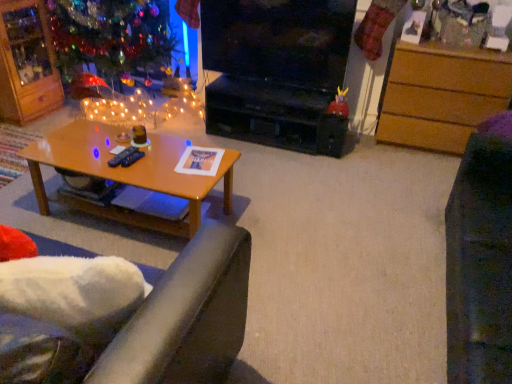
The image size is (512, 384). Find the location of `free space in front of satin blue remote control at center, which is the 1th remote control from left to right`. free space in front of satin blue remote control at center, which is the 1th remote control from left to right is located at coordinates pyautogui.click(x=115, y=168).